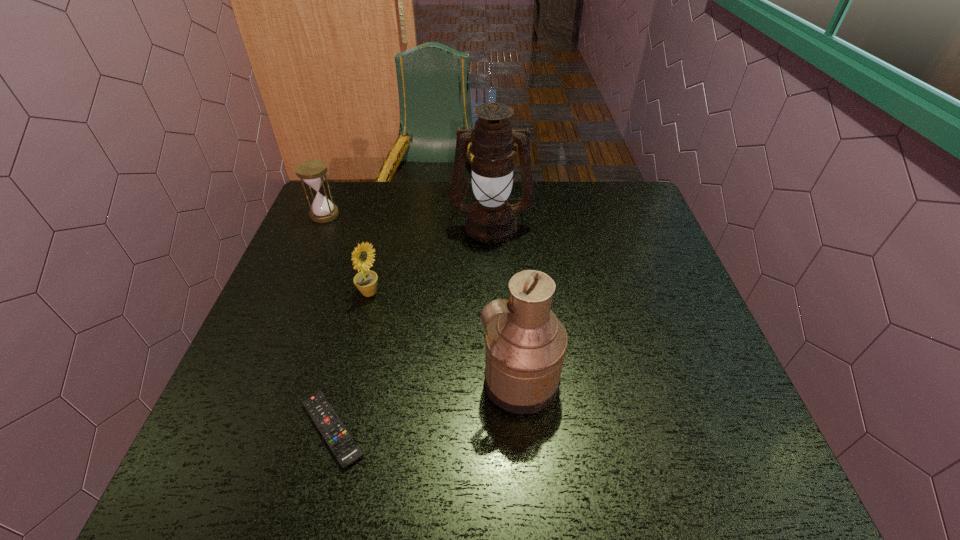
Locate an element on the screen. The image size is (960, 540). oil lamp that is at the far edge is located at coordinates [491, 219].

This screenshot has height=540, width=960. Find the location of `hourglass that is at the far edge`. hourglass that is at the far edge is located at coordinates (312, 172).

The height and width of the screenshot is (540, 960). I want to click on object that is positioned at the near edge, so click(345, 449).

At what (x,y) coordinates should I click in order to perform the action: click on hourglass at the left edge. Please return your answer as a coordinate pair (x, y). The width and height of the screenshot is (960, 540). Looking at the image, I should click on (312, 172).

You are a GUI agent. You are given a task and a screenshot of the screen. Output one action in this format:
    pyautogui.click(x=<x>, y=<y>)
    Task: Click on the remote control located at the left edge
    This screenshot has width=960, height=540.
    Given the screenshot: What is the action you would take?
    pyautogui.click(x=345, y=449)

Where is `object that is at the far left corner`? The width and height of the screenshot is (960, 540). object that is at the far left corner is located at coordinates (312, 172).

Find the location of a particular element. The image size is (960, 540). object that is positioned at the near left corner is located at coordinates (345, 449).

At what (x,y) coordinates should I click in order to perform the action: click on free spot at the far edge of the desktop. Please return your answer as a coordinate pair (x, y). Looking at the image, I should click on (392, 185).

You are a GUI agent. You are given a task and a screenshot of the screen. Output one action in this format:
    pyautogui.click(x=<x>, y=<y>)
    Task: Click on the vacant space at the near edge
    This screenshot has height=540, width=960.
    Given the screenshot: What is the action you would take?
    pyautogui.click(x=529, y=475)

Where is `vacant space at the left edge of the desktop`? This screenshot has width=960, height=540. vacant space at the left edge of the desktop is located at coordinates (233, 401).